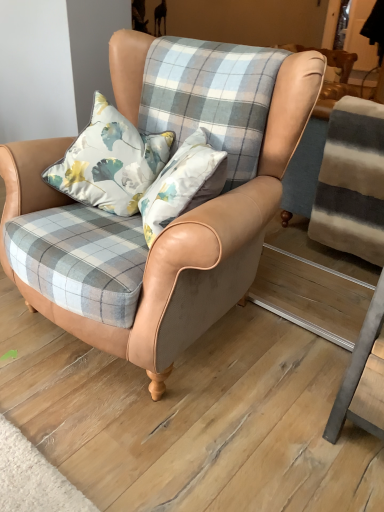
Question: Can we say leather armchair at center lies outside floral satin pillow at center?

Choices:
 (A) yes
 (B) no

Answer: (A)

Question: Is leather armchair at center at the right side of floral satin pillow at center?

Choices:
 (A) no
 (B) yes

Answer: (B)

Question: Can you confirm if leather armchair at center is shorter than floral satin pillow at center?

Choices:
 (A) yes
 (B) no

Answer: (B)

Question: Can you confirm if leather armchair at center is wider than floral satin pillow at center?

Choices:
 (A) yes
 (B) no

Answer: (A)

Question: Is floral satin pillow at center completely or partially inside leather armchair at center?

Choices:
 (A) no
 (B) yes

Answer: (B)

Question: From the image's perspective, is leather armchair at center located beneath floral satin pillow at center?

Choices:
 (A) yes
 (B) no

Answer: (A)

Question: Could you tell me if floral satin pillow at center is turned towards leather armchair at center?

Choices:
 (A) yes
 (B) no

Answer: (A)

Question: Does floral satin pillow at center have a smaller size compared to leather armchair at center?

Choices:
 (A) no
 (B) yes

Answer: (B)

Question: Is floral satin pillow at center positioned before leather armchair at center?

Choices:
 (A) no
 (B) yes

Answer: (A)

Question: Is floral satin pillow at center further to the viewer compared to leather armchair at center?

Choices:
 (A) no
 (B) yes

Answer: (B)

Question: From a real-world perspective, is floral satin pillow at center below leather armchair at center?

Choices:
 (A) yes
 (B) no

Answer: (B)

Question: Does floral satin pillow at center have a greater width compared to leather armchair at center?

Choices:
 (A) no
 (B) yes

Answer: (A)

Question: Is leather armchair at center bigger or smaller than floral satin pillow at center?

Choices:
 (A) big
 (B) small

Answer: (A)